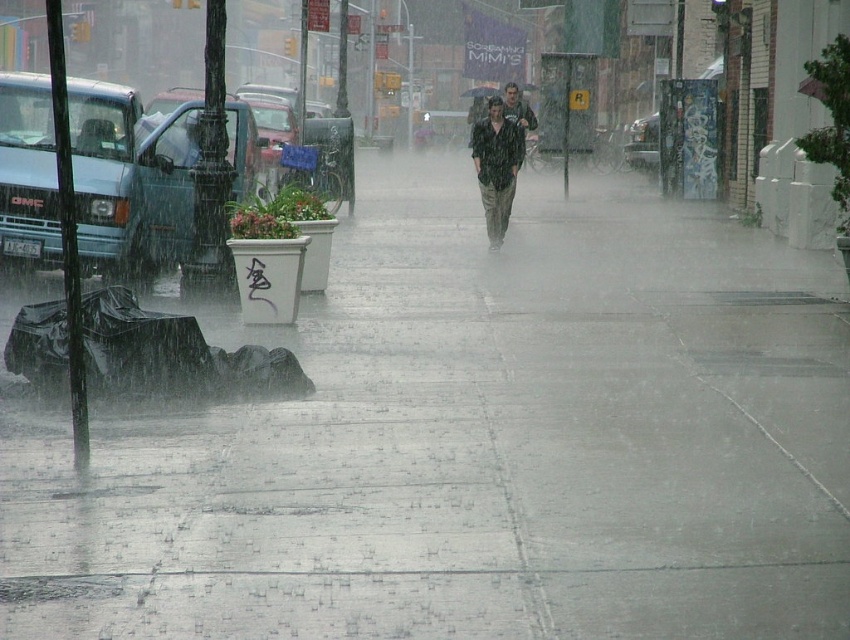
Does point (503, 134) lie in front of point (496, 88)?

Yes.

Find the location of a particular element. The height and width of the screenshot is (640, 850). matte black shirt at center is located at coordinates (496, 166).